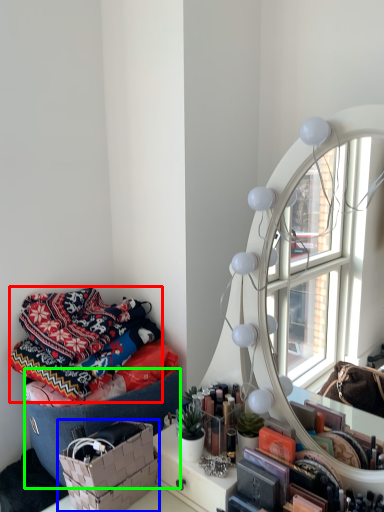
Question: Which object is positioned closest to blanket (highlighted by a red box)? Select from basket (highlighted by a blue box) and storage box (highlighted by a green box).

Choices:
 (A) basket
 (B) storage box

Answer: (B)